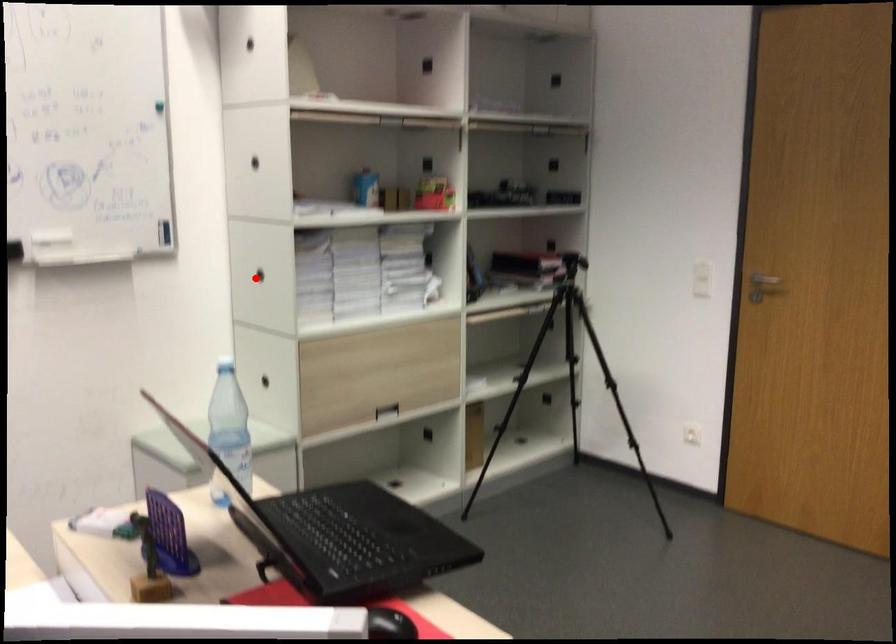
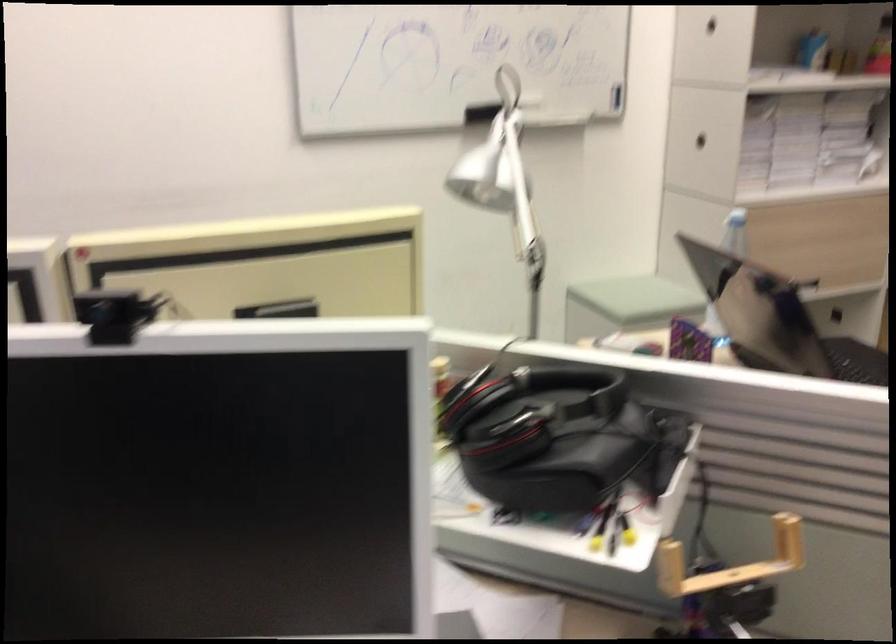
Question: I am providing you with two images of the same scene from different viewpoints. A red point is marked on the first image. Is the red point's position out of view in image 2?

Choices:
 (A) Yes
 (B) No

Answer: (B)